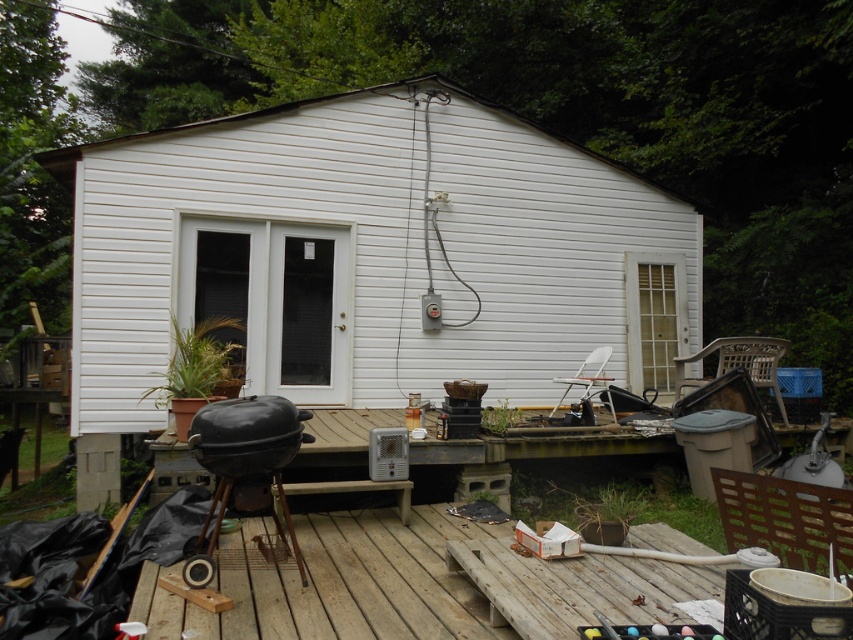
Measure the distance from white siding shed at center to wooden bench at lower center.

white siding shed at center and wooden bench at lower center are 3.59 meters apart.

Which is above, white siding shed at center or wooden bench at lower center?

white siding shed at center

Is point (675, 316) behind point (233, 614)?

Yes, it is.

Image resolution: width=853 pixels, height=640 pixels. Find the location of `white siding shed at center`. white siding shed at center is located at coordinates (367, 257).

Which of these two, wooden bench at lower center or black matte barbecue grill at lower left, stands taller?

black matte barbecue grill at lower left is taller.

Looking at this image, is wooden bench at lower center thinner than black matte barbecue grill at lower left?

Incorrect, wooden bench at lower center's width is not less than black matte barbecue grill at lower left's.

The image size is (853, 640). What are the coordinates of `wooden bench at lower center` in the screenshot? It's located at (416, 586).

Is white siding shed at center to the left of black matte barbecue grill at lower left from the viewer's perspective?

No, white siding shed at center is not to the left of black matte barbecue grill at lower left.

Is white siding shed at center in front of black matte barbecue grill at lower left?

No.

Between point (454, 376) and point (233, 452), which one is positioned in front?

Point (233, 452) is more forward.

The image size is (853, 640). Find the location of `white siding shed at center`. white siding shed at center is located at coordinates (367, 257).